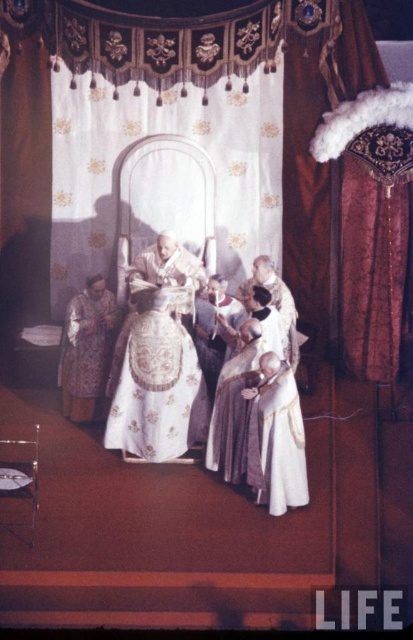
You are attending a religious ceremony inside a church and notice two points marked in the scene. The first point is at coordinate point [114,404] and the second at point [63,376]. Which point is closer to you as you stand at the entrance?

Point [114,404] is closer to the viewer than point [63,376].

You are attending a religious ceremony and want to position yourself so that you are directly in front of both point (125, 385) and point (289, 432). Is this possible?

No, because point (125, 385) is behind point (289, 432), so you cannot be directly in front of both simultaneously.

You are an event planner organizing a religious ceremony. You need to ensure that the white satin robe at center and the silky purple robe at lower left are displayed appropriately. Which robe should be placed in a display case that requires a narrower space?

The white satin robe at center is thinner than the silky purple robe at lower left, so it should be placed in the display case that requires a narrower space.